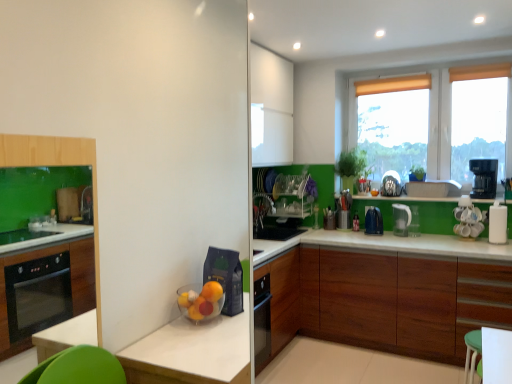
Where is `free region on the left part of white glossy coffee maker at right, the 3th appliance positioned from the left`? free region on the left part of white glossy coffee maker at right, the 3th appliance positioned from the left is located at coordinates (445, 242).